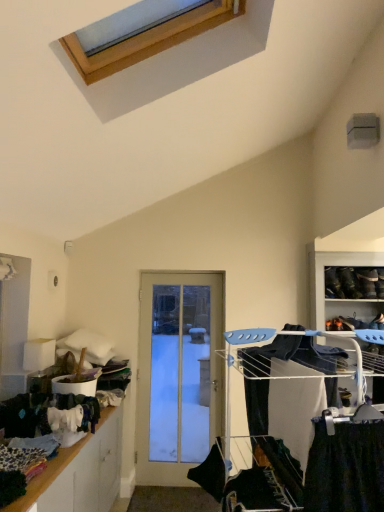
Question: Is white metal drying rack at right outside of white glass door at center?

Choices:
 (A) yes
 (B) no

Answer: (A)

Question: Is white metal drying rack at right at the left side of white glass door at center?

Choices:
 (A) no
 (B) yes

Answer: (A)

Question: Is white metal drying rack at right wider than white glass door at center?

Choices:
 (A) no
 (B) yes

Answer: (B)

Question: Can you confirm if white metal drying rack at right is bigger than white glass door at center?

Choices:
 (A) yes
 (B) no

Answer: (A)

Question: Considering the relative sizes of white metal drying rack at right and white glass door at center in the image provided, is white metal drying rack at right shorter than white glass door at center?

Choices:
 (A) yes
 (B) no

Answer: (A)

Question: In the image, is white metal drying rack at right positioned in front of or behind wooden shelf at lower left?

Choices:
 (A) front
 (B) behind

Answer: (A)

Question: Considering the positions of point (329, 497) and point (102, 421), is point (329, 497) closer or farther from the camera than point (102, 421)?

Choices:
 (A) farther
 (B) closer

Answer: (B)

Question: From their relative heights in the image, would you say white metal drying rack at right is taller or shorter than wooden shelf at lower left?

Choices:
 (A) tall
 (B) short

Answer: (A)

Question: In the image, is white metal drying rack at right on the left side or the right side of wooden shelf at lower left?

Choices:
 (A) left
 (B) right

Answer: (B)

Question: Is point (220, 438) closer or farther from the camera than point (56, 499)?

Choices:
 (A) farther
 (B) closer

Answer: (B)

Question: From a real-world perspective, relative to wooden shelf at lower left, is black fabric at center vertically above or below?

Choices:
 (A) below
 (B) above

Answer: (B)

Question: In the image, is black fabric at center positioned in front of or behind wooden shelf at lower left?

Choices:
 (A) front
 (B) behind

Answer: (B)

Question: Is black fabric at center wider or thinner than wooden shelf at lower left?

Choices:
 (A) thin
 (B) wide

Answer: (A)

Question: Considering the positions of white glass door at center and white metal drying rack at right in the image, is white glass door at center wider or thinner than white metal drying rack at right?

Choices:
 (A) wide
 (B) thin

Answer: (B)

Question: Is white glass door at center inside or outside of white metal drying rack at right?

Choices:
 (A) outside
 (B) inside

Answer: (A)